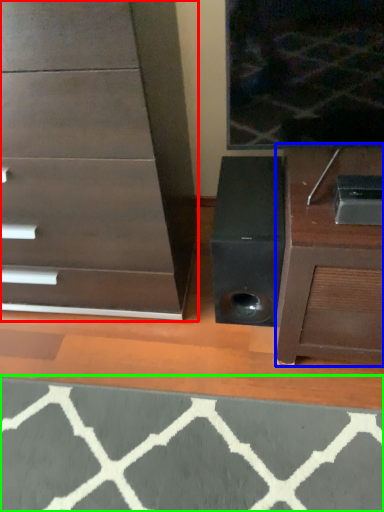
Question: Based on their relative distances, which object is farther from chest of drawers (highlighted by a red box)? Choose from furniture (highlighted by a blue box) and doormat (highlighted by a green box).

Choices:
 (A) furniture
 (B) doormat

Answer: (B)